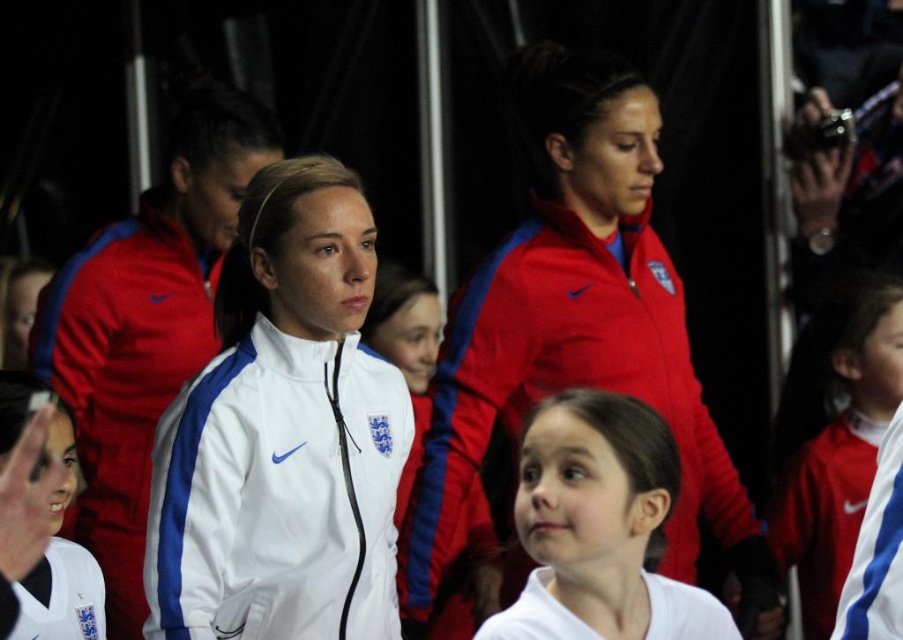
You are a photographer trying to capture a group photo of the team members. You notice the matte red jacket at center and the white fabric jacket at center. Which jacket should you focus on to ensure it fits within the frame if your camera has a limited horizontal field of view?

The matte red jacket at center might be wider than the white fabric jacket at center, so focusing on the matte red jacket at center would be better to ensure it fits within the frame due to its potential wider width.